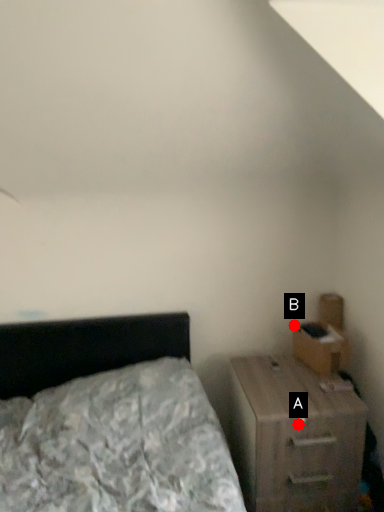
Question: Two points are circled on the image, labeled by A and B beside each circle. Which of the following is the farthest from the observer?

Choices:
 (A) A is further
 (B) B is further

Answer: (B)